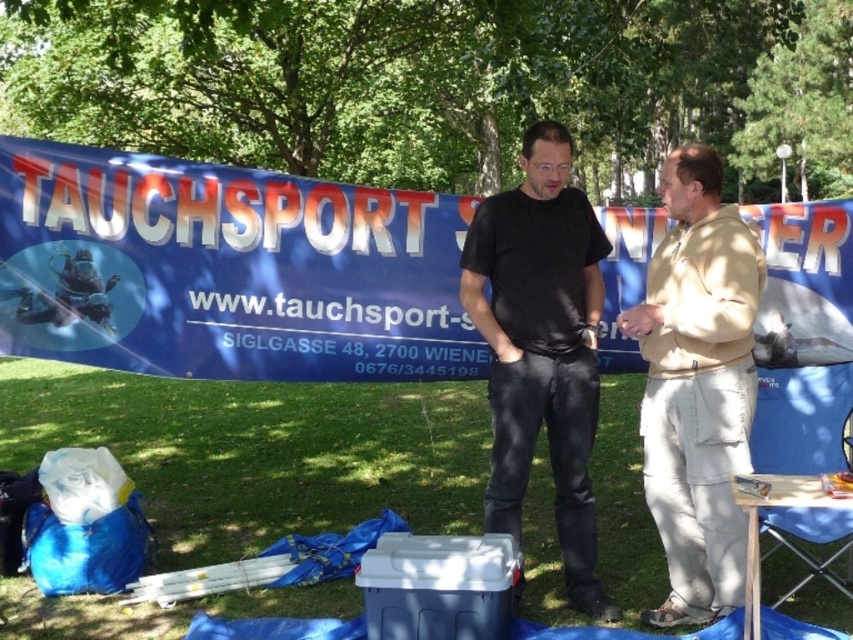
Based on the photo, you are standing in the park where the large blue banner about diving is displayed. You notice two specific points marked on the ground. The first point is at coordinates point (x=693, y=176), and the second point is at coordinates point (x=524, y=480). If you are facing the banner, which of these two points is closer to you?

Point (x=693, y=176) is in front of point (x=524, y=480), so if you are facing the banner, the point (x=693, y=176) is closer to you.

You are a photographer taking a picture of the banner for the diving club. You notice the beige cotton pants at right and the black matte shirt at center in the foreground. Which clothing item is closer to the camera?

The black matte shirt at center is closer to the camera because the beige cotton pants at right is positioned under it, indicating it is behind and thus farther away.